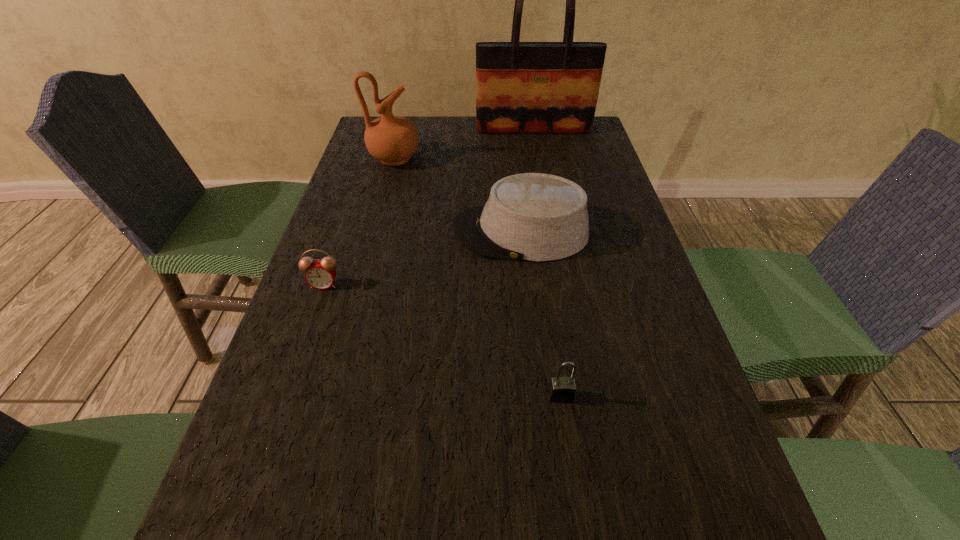
Find the location of a particular element. The width and height of the screenshot is (960, 540). object at the far left corner is located at coordinates (391, 139).

Locate an element on the screen. This screenshot has height=540, width=960. object that is at the far right corner is located at coordinates pos(521,87).

The image size is (960, 540). Find the location of `vacant area at the far edge of the desktop`. vacant area at the far edge of the desktop is located at coordinates (516, 147).

The image size is (960, 540). I want to click on free space at the left edge of the desktop, so pos(374,170).

Locate an element on the screen. The height and width of the screenshot is (540, 960). blank space at the right edge is located at coordinates (557, 158).

The height and width of the screenshot is (540, 960). In the image, there is a desktop. Find the location of `vacant space at the far right corner`. vacant space at the far right corner is located at coordinates (552, 145).

The width and height of the screenshot is (960, 540). I want to click on free space between the second farthest object and the tallest object, so click(464, 145).

Locate an element on the screen. The height and width of the screenshot is (540, 960). blank region between the pottery and the alarm clock is located at coordinates (359, 221).

I want to click on free spot between the second tallest object and the padlock, so click(x=478, y=277).

Find the location of a particular element. vacant space that is in between the pottery and the padlock is located at coordinates (478, 277).